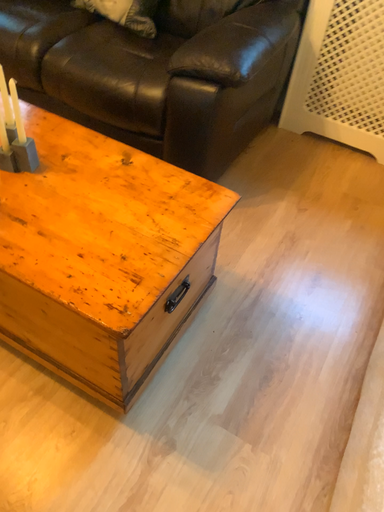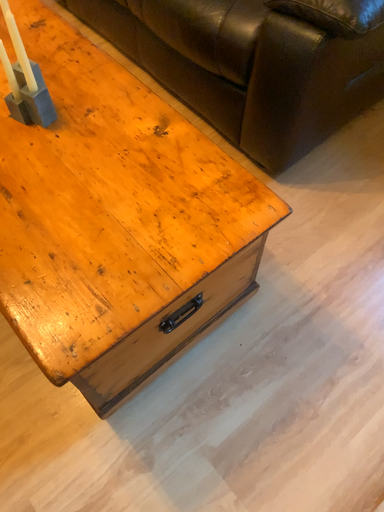
Question: Which way did the camera rotate in the video?

Choices:
 (A) rotated right
 (B) rotated left

Answer: (B)